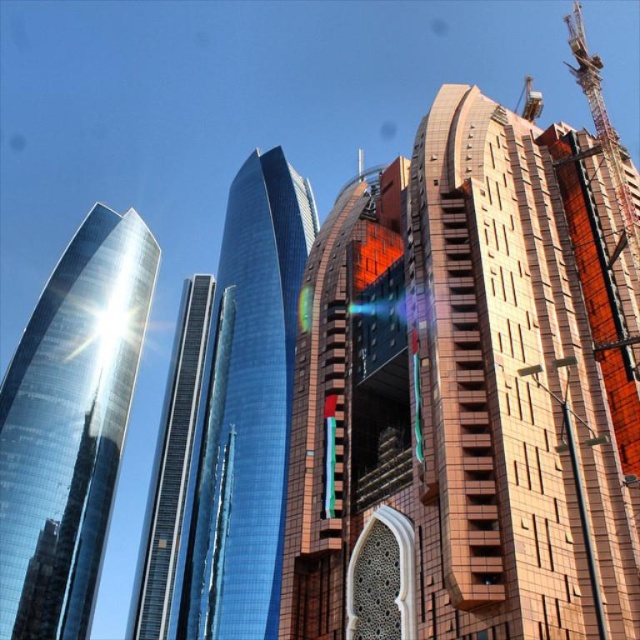
You are an architect planning to place a new sculpture between the glossy glass skyscraper at center and the shiny glass skyscraper at center. The sculpture requires a minimum of 10 meters of space between the two buildings to be placed safely. Given their widths, can the sculpture be placed between them?

The glossy glass skyscraper at center is wider than the shiny glass skyscraper at center. However, the exact widths are not provided, so we cannot determine if the space between them meets the 10 meter requirement. More information is needed.

You are a drone operator trying to navigate between two skyscrapers in the city. You need to fly your drone to a specific point marked at point (x=244, y=412). Which skyscraper should you fly towards?

You should fly towards the glossy glass skyscraper at center because it is located at point (x=244, y=412).